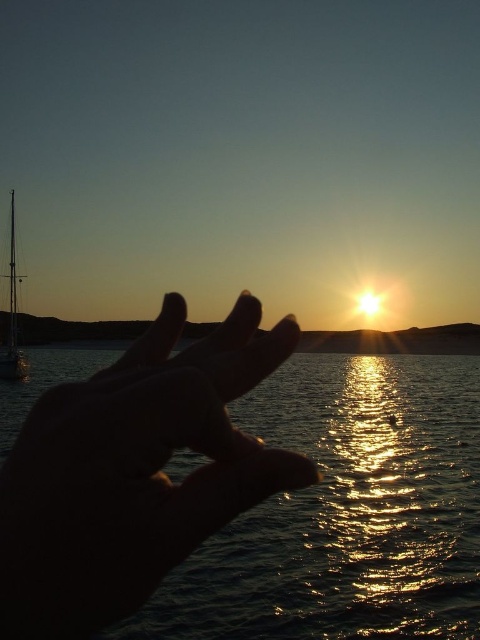
You are observing the sunset scene and notice two points in the image. The first point is at coordinates point (82,428) and the second is at point (22,378). Which point is closer to you?

Point (82,428) is closer to the viewer than point (22,378).

You are standing on the beach and want to walk from the shiny metallic sailboat at left to the smooth sand horizon at center. How far will you have to walk?

The distance between the shiny metallic sailboat at left and the smooth sand horizon at center is 58.86 meters, so you will have to walk 58.86 meters.